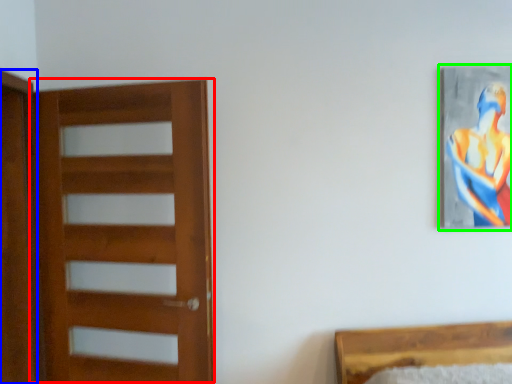
Question: Considering the real-world distances, which object is closest to door (highlighted by a red box)? screen door (highlighted by a blue box) or picture frame (highlighted by a green box).

Choices:
 (A) screen door
 (B) picture frame

Answer: (A)